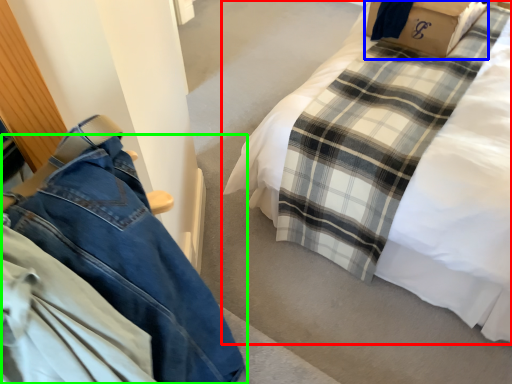
Question: Which object is the closest to the bed (highlighted by a red box)? Choose among these: cardboard box (highlighted by a blue box) or trousers (highlighted by a green box).

Choices:
 (A) cardboard box
 (B) trousers

Answer: (A)